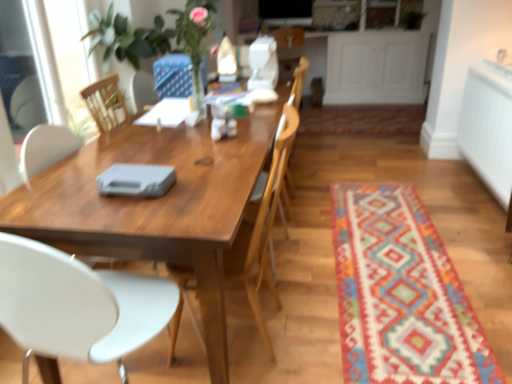
Question: Is multicolored woven mat at lower right, the first mat positioned from the bottom, taller or shorter than white textured radiator at right?

Choices:
 (A) tall
 (B) short

Answer: (B)

Question: From the image's perspective, relative to white textured radiator at right, is multicolored woven mat at lower right, the first mat in the front-to-back sequence, above or below?

Choices:
 (A) above
 (B) below

Answer: (B)

Question: Estimate the real-world distances between objects in this image. Which object is farther from the multicolored woven rug at center, which appears as the second mat when ordered from the bottom?

Choices:
 (A) multicolored woven mat at lower right, the first mat positioned from the bottom
 (B) wooden chair at center, acting as the 2th chair starting from the left
 (C) wooden table at center
 (D) white textured radiator at right
 (E) wooden chair at center, which is counted as the 1th armchair, starting from the right

Answer: (C)

Question: Considering the real-world distances, which object is closest to the white plastic chair at left, marked as the second chair in a right-to-left arrangement?

Choices:
 (A) multicolored woven mat at lower right, which ranks as the 2th mat in back-to-front order
 (B) blue fabric armchair at upper center, which is counted as the second armchair, starting from the right
 (C) wooden table at center
 (D) multicolored woven rug at center, the first mat when ordered from top to bottom
 (E) wooden chair at center, which is the first chair in right-to-left order

Answer: (C)